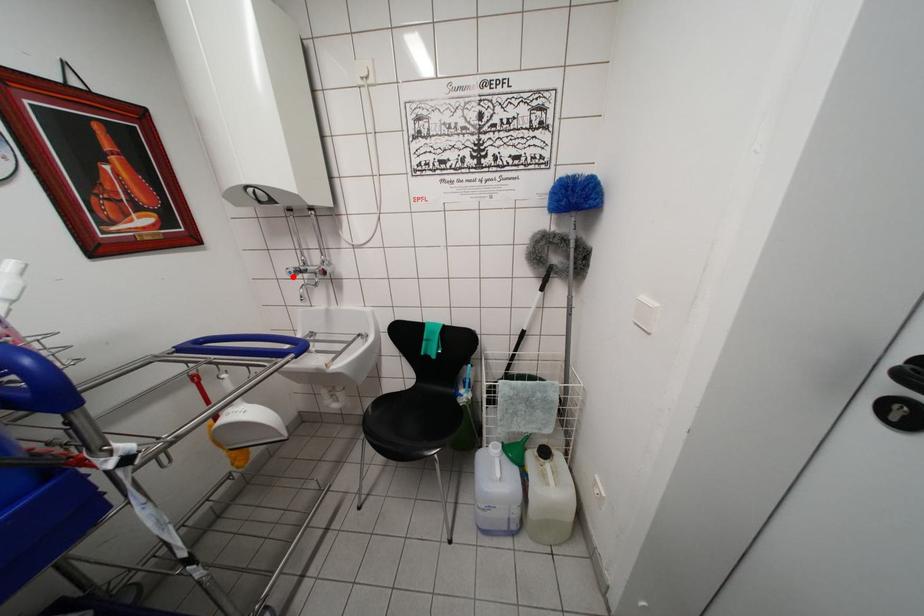
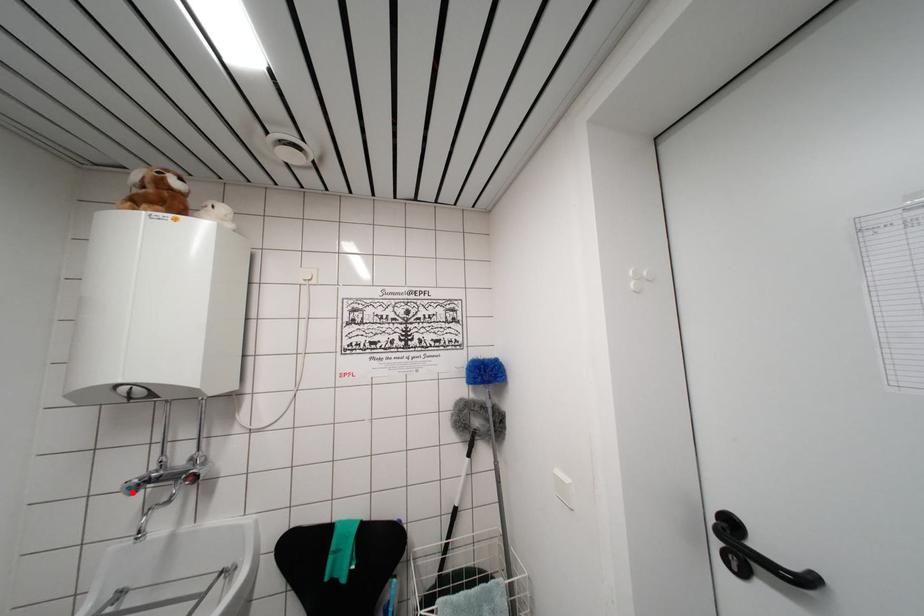
Consider the image. I am providing you with two images of the same scene from different viewpoints. A red point is marked on the first image and another point is marked on the second image. Are the points marked in image1 and image2 representing the same 3D position?

Yes